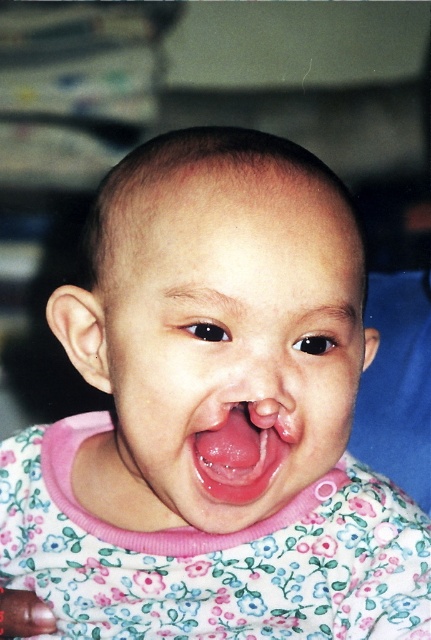
Find the location of `pink fabric face at center`. pink fabric face at center is located at coordinates (230, 356).

Which is behind, point (215, 224) or point (246, 488)?

Positioned behind is point (246, 488).

This screenshot has width=431, height=640. What do you see at coordinates (230, 356) in the screenshot?
I see `pink fabric face at center` at bounding box center [230, 356].

Find the location of `pink fabric face at center`. pink fabric face at center is located at coordinates (230, 356).